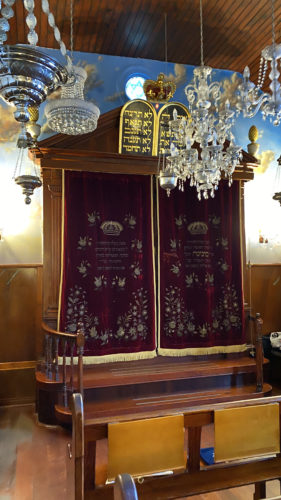
The height and width of the screenshot is (500, 281). Identify the location of wall. (27, 256).